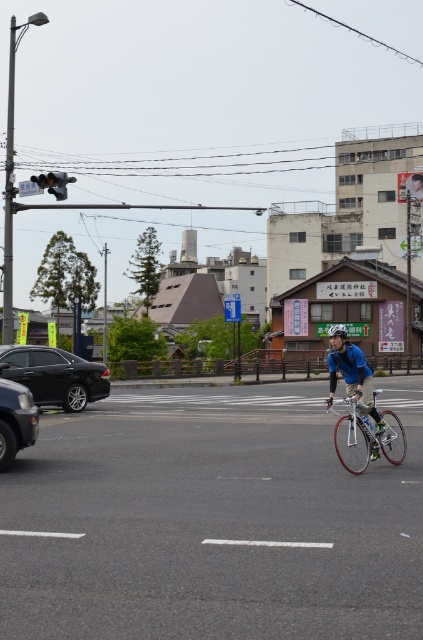
Question: Which point is farther to the camera?

Choices:
 (A) shiny black sedan at left
 (B) shiny black car at left
 (C) blue fabric jacket at center

Answer: (A)

Question: Which point is farther to the camera?

Choices:
 (A) white matte bicycle helmet at center
 (B) metallic traffic light at upper left
 (C) blue fabric jacket at center

Answer: (B)

Question: Is silver metallic bicycle at center to the left of blue fabric jacket at center from the viewer's perspective?

Choices:
 (A) yes
 (B) no

Answer: (A)

Question: In this image, where is blue fabric jacket at center located relative to metallic traffic light at upper left?

Choices:
 (A) left
 (B) right

Answer: (B)

Question: Can you confirm if shiny black sedan at left is wider than blue fabric jacket at center?

Choices:
 (A) no
 (B) yes

Answer: (B)

Question: Among these objects, which one is farthest from the camera?

Choices:
 (A) shiny black car at left
 (B) silver metallic bicycle at center
 (C) white matte bicycle helmet at center
 (D) blue fabric jacket at center

Answer: (B)